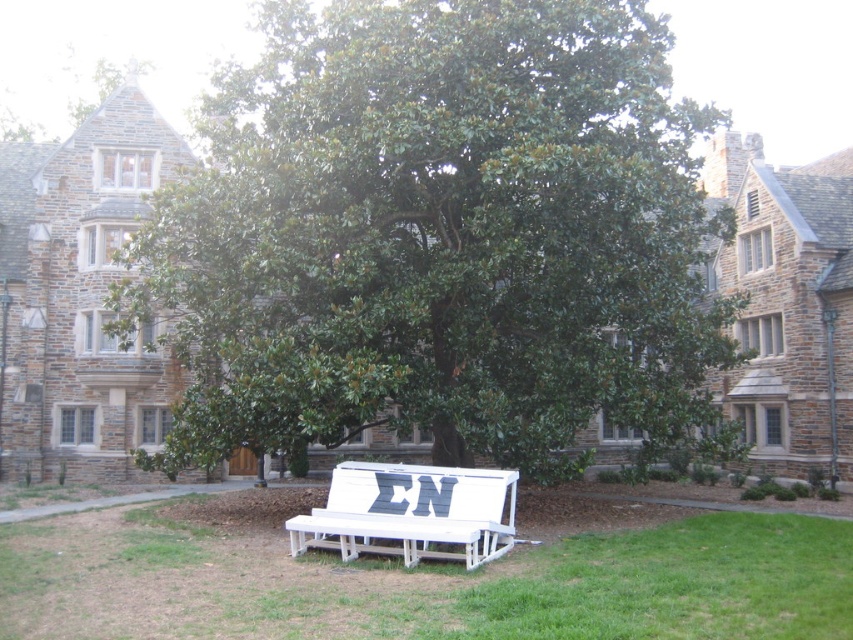
Between point (341, 400) and point (451, 490), which one is positioned behind?

The point (341, 400) is more distant.

In the scene shown: Who is shorter, green leafy tree at center or white painted wood bench at center?

Standing shorter between the two is white painted wood bench at center.

Find the location of `green leafy tree at center`. green leafy tree at center is located at coordinates (444, 237).

Is green leafy tree at center bigger than white wooden bench at center?

Yes.

Which is below, green leafy tree at center or white wooden bench at center?

white wooden bench at center

Find the location of a particular element. The image size is (853, 640). green leafy tree at center is located at coordinates (444, 237).

Does white wooden bench at center appear on the left side of white painted wood bench at center?

No, white wooden bench at center is not to the left of white painted wood bench at center.

Is point (397, 611) closer to camera compared to point (402, 493)?

Yes, point (397, 611) is closer to viewer.

The height and width of the screenshot is (640, 853). Identify the location of white wooden bench at center. (424, 576).

At what (x,y) coordinates should I click in order to perform the action: click on white wooden bench at center. Please return your answer as a coordinate pair (x, y). Looking at the image, I should click on (424, 576).